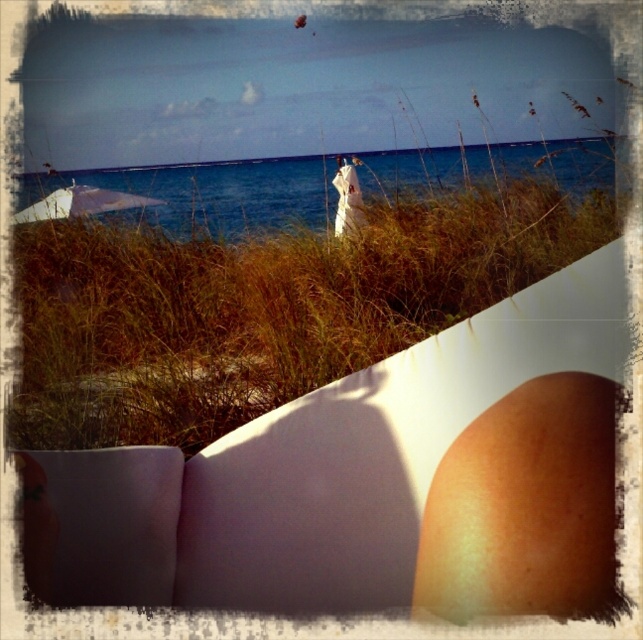
Can you confirm if brown grass at center is positioned to the right of blue water at center?

Indeed, brown grass at center is positioned on the right side of blue water at center.

The height and width of the screenshot is (640, 643). I want to click on brown grass at center, so click(x=260, y=307).

At what (x,y) coordinates should I click in order to perform the action: click on brown grass at center. Please return your answer as a coordinate pair (x, y). The width and height of the screenshot is (643, 640). Looking at the image, I should click on (260, 307).